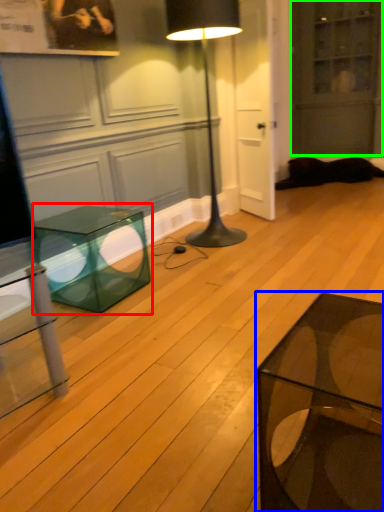
Question: Which object is the farthest from table (highlighted by a red box)? Choose among these: coffee table (highlighted by a blue box) or glass door (highlighted by a green box).

Choices:
 (A) coffee table
 (B) glass door

Answer: (B)